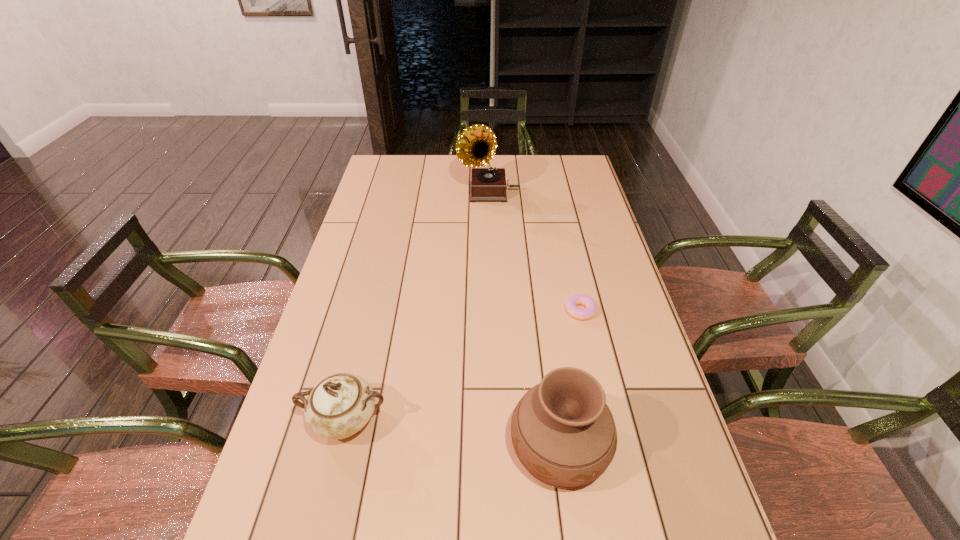
Locate an element on the screen. This screenshot has height=540, width=960. free space at the far left corner of the desktop is located at coordinates (400, 156).

The image size is (960, 540). I want to click on free region at the far right corner, so click(570, 184).

Where is `free space between the leftmost object and the phonograph record`? Image resolution: width=960 pixels, height=540 pixels. free space between the leftmost object and the phonograph record is located at coordinates (x=418, y=306).

This screenshot has height=540, width=960. What are the coordinates of `free space between the second farthest object and the chinaware` in the screenshot? It's located at pyautogui.click(x=463, y=366).

Image resolution: width=960 pixels, height=540 pixels. Identify the location of empty space between the leftmost object and the urn. (452, 433).

Identify the location of blank region between the chinaware and the shortest object. The image size is (960, 540). (463, 366).

Where is `vacant area that lies between the third tallest object and the third nearest object`? vacant area that lies between the third tallest object and the third nearest object is located at coordinates (463, 366).

I want to click on vacant area that lies between the farthest object and the chinaware, so click(x=418, y=306).

Identify the location of vacant area between the second tallest object and the chinaware. (452, 433).

Identify the location of free space between the chinaware and the urn. Image resolution: width=960 pixels, height=540 pixels. (452, 433).